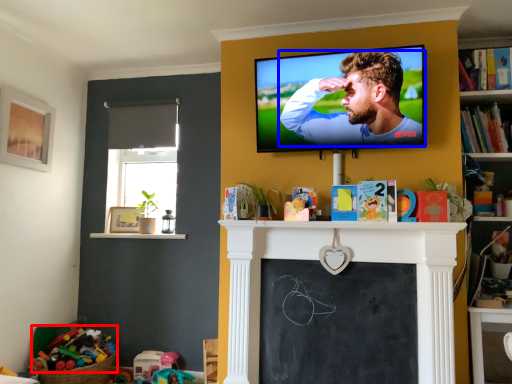
Question: Which object is further to the camera taking this photo, toy (highlighted by a red box) or man (highlighted by a blue box)?

Choices:
 (A) toy
 (B) man

Answer: (A)